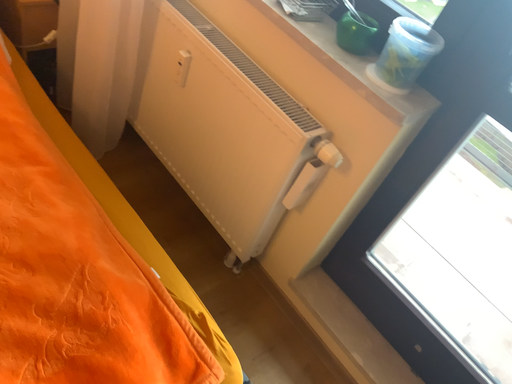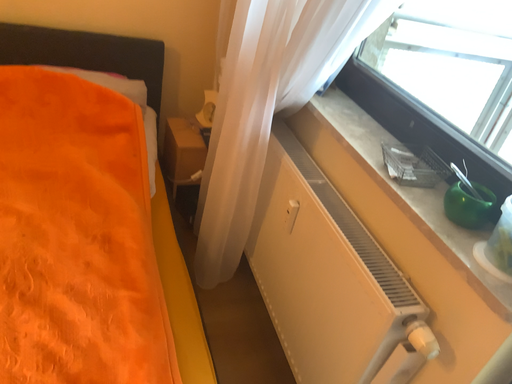
Question: How did the camera likely rotate when shooting the video?

Choices:
 (A) rotated upward
 (B) rotated downward

Answer: (A)